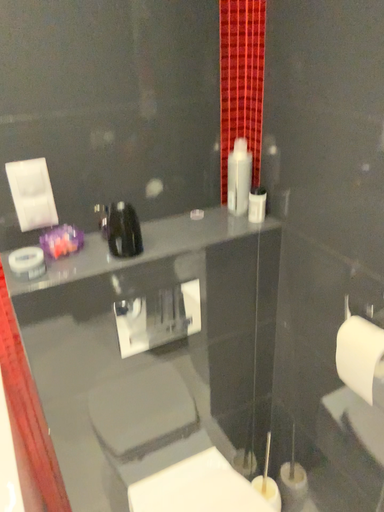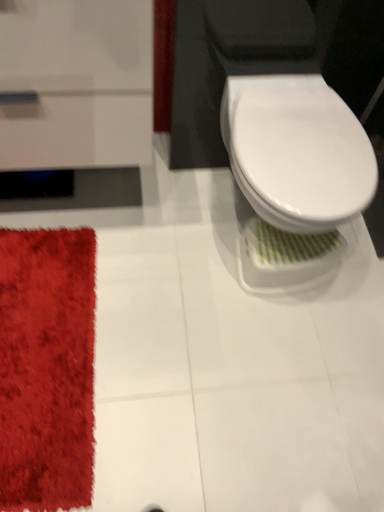
Question: Which way did the camera rotate in the video?

Choices:
 (A) rotated right
 (B) rotated left

Answer: (B)